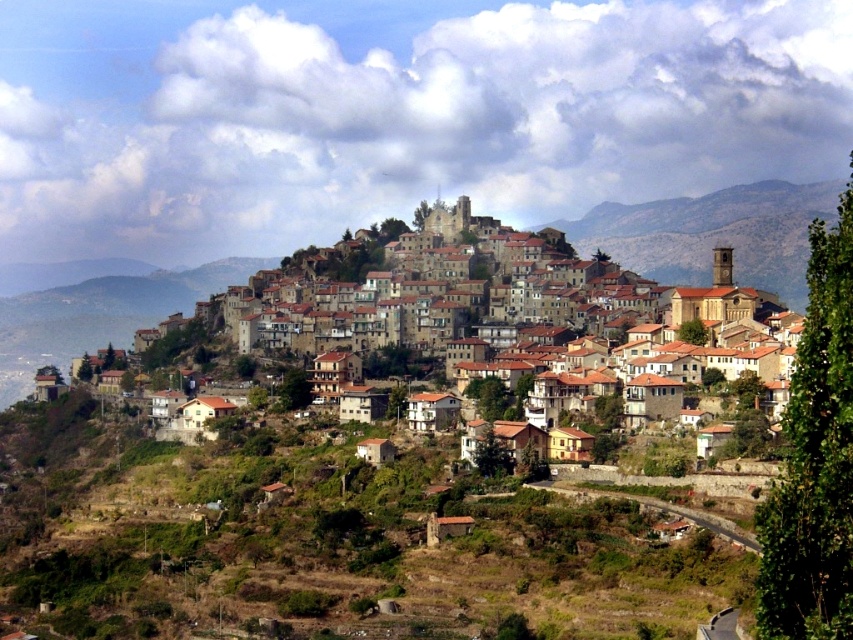
You are a photographer planning to capture a wide shot of the brown stone buildings at center and the brown rocky mountain at center from a distance. Based on their widths, which object will appear wider in the photograph?

The brown stone buildings at center will appear wider in the photograph because their width surpasses that of the brown rocky mountain at center.

You are navigating a drone over the hillside town and need to deliver a package to the brown stone buildings at center. According to the coordinates provided, where exactly should you direct the drone to land?

The brown stone buildings at center are located at point (x=711, y=236), so direct the drone to land there.